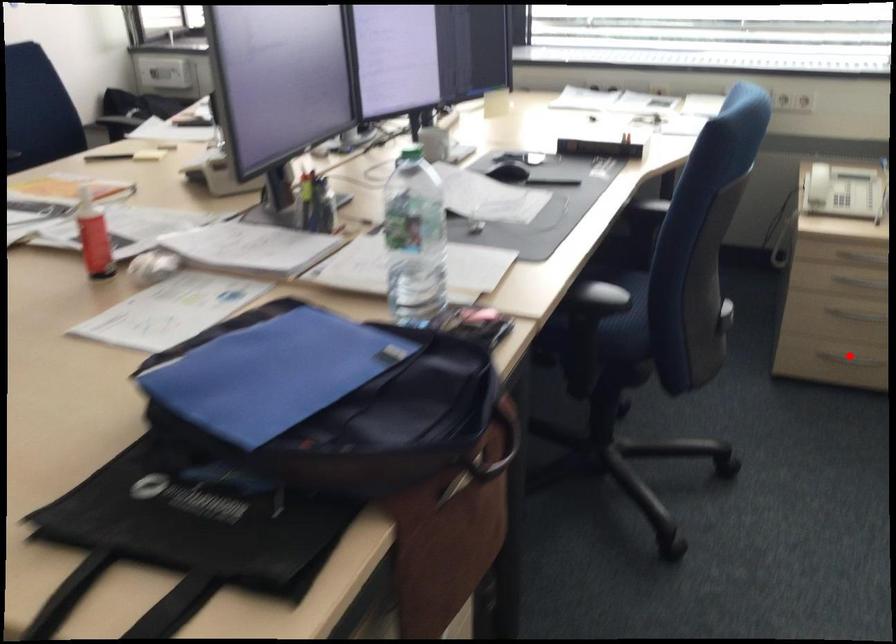
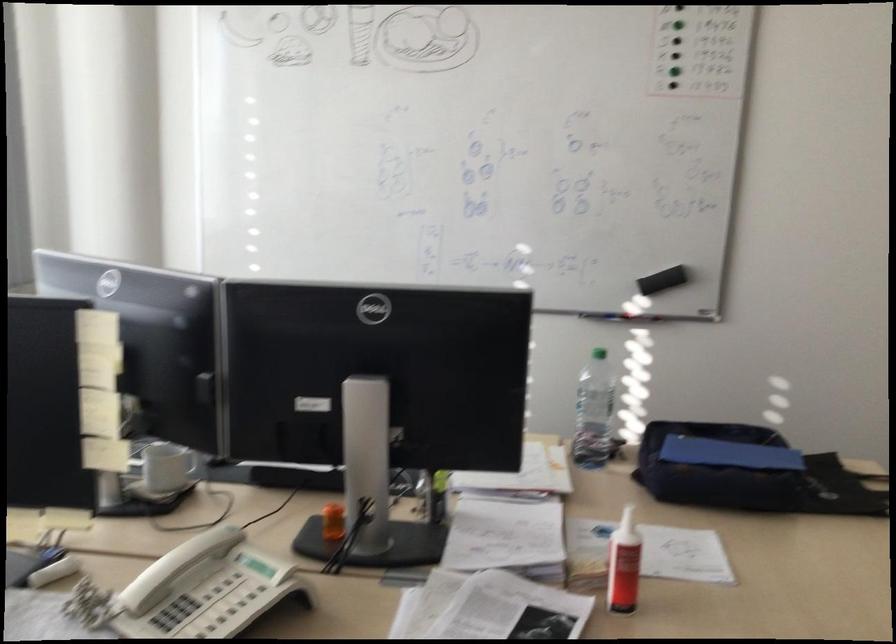
Question: I am providing you with two images of the same scene from different viewpoints. A red point is marked on the first image. Is the red point's position out of view in image 2?

Choices:
 (A) Yes
 (B) No

Answer: (A)